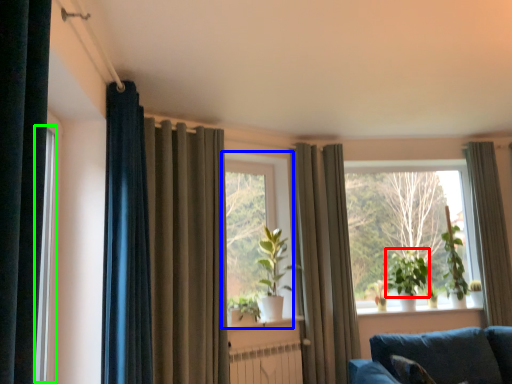
Question: Estimate the real-world distances between objects in this image. Which object is closer to plant (highlighted by a red box), window (highlighted by a blue box) or window frame (highlighted by a green box)?

Choices:
 (A) window
 (B) window frame

Answer: (A)